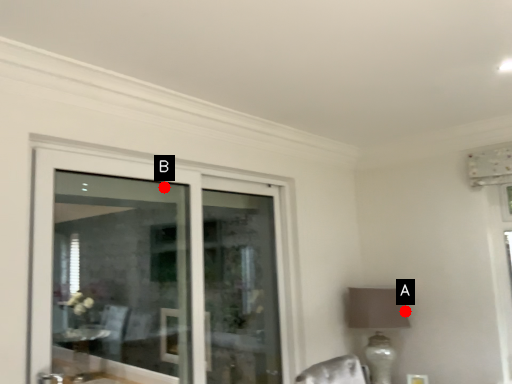
Question: Two points are circled on the image, labeled by A and B beside each circle. Which point appears closest to the camera in this image?

Choices:
 (A) A is closer
 (B) B is closer

Answer: (B)